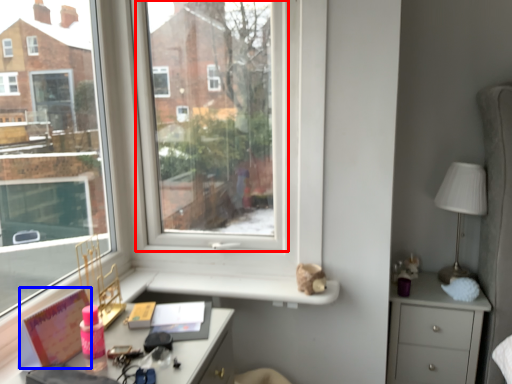
Question: Which point is further to the camera, window screen (highlighted by a red box) or book (highlighted by a blue box)?

Choices:
 (A) window screen
 (B) book

Answer: (A)